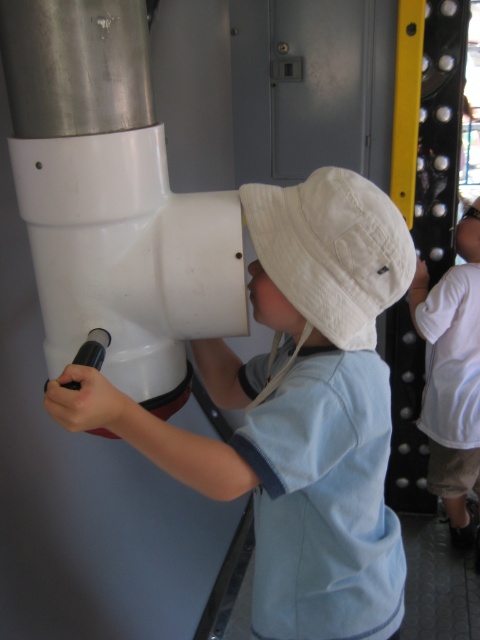
Question: Does white matte hat at center appear on the right side of white matte telescope at center?

Choices:
 (A) no
 (B) yes

Answer: (B)

Question: Does white matte hat at center have a larger size compared to white matte telescope at center?

Choices:
 (A) no
 (B) yes

Answer: (B)

Question: Estimate the real-world distances between objects in this image. Which object is closer to the white matte telescope at center?

Choices:
 (A) white cotton hat at upper center
 (B) white cotton baseball hat at center

Answer: (B)

Question: Which point is farther from the camera taking this photo?

Choices:
 (A) (408, 266)
 (B) (375, 508)
 (C) (115, 342)
 (D) (451, 442)

Answer: (D)

Question: Which object is positioned closest to the white cotton baseball hat at center?

Choices:
 (A) white matte telescope at center
 (B) white cotton hat at upper center
 (C) white matte hat at center

Answer: (C)

Question: Is white cotton baseball hat at center to the right of white cotton hat at upper center from the viewer's perspective?

Choices:
 (A) no
 (B) yes

Answer: (A)